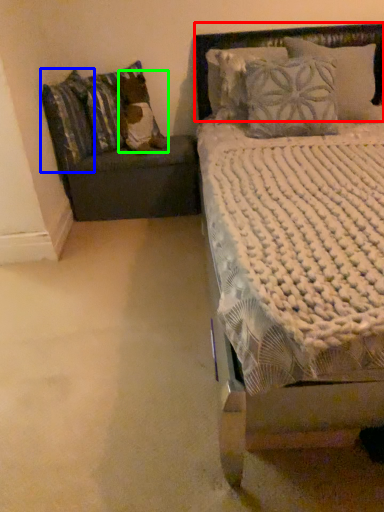
Question: Which is farther away from headboard (highlighted by a red box)? pillow (highlighted by a blue box) or pillow (highlighted by a green box)?

Choices:
 (A) pillow
 (B) pillow

Answer: (A)